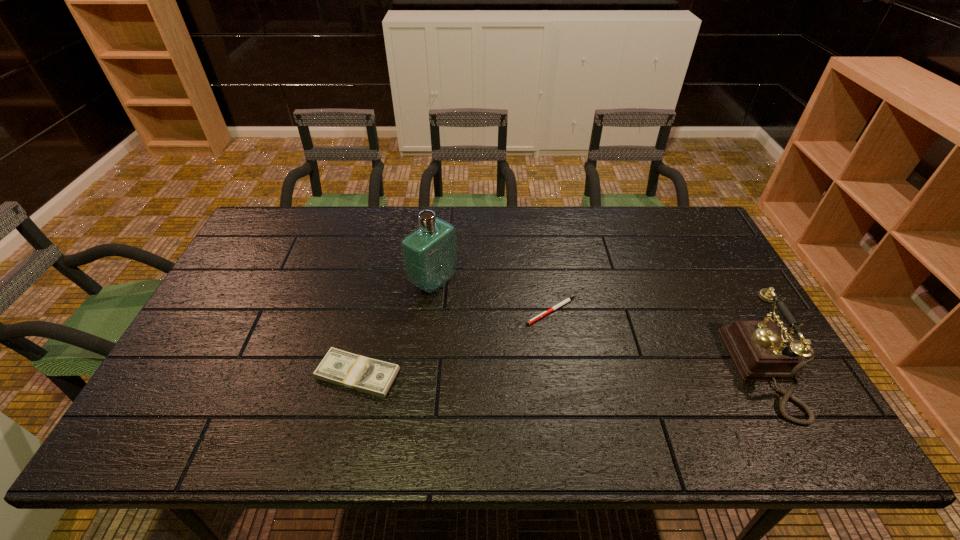
Find the location of a particular element. Image resolution: width=960 pixels, height=540 pixels. vacant space located 0.240m on the clicker of the pen is located at coordinates (513, 396).

Where is `free point located on the clicker of the pen`? free point located on the clicker of the pen is located at coordinates (518, 383).

Locate an element on the screen. vacant space located on the clicker of the pen is located at coordinates (529, 358).

The width and height of the screenshot is (960, 540). I want to click on dollar present at the near edge, so point(356,372).

Locate an element on the screen. telephone that is at the near edge is located at coordinates click(x=761, y=352).

Locate an element on the screen. object positioned at the right edge is located at coordinates (761, 352).

Identify the location of object located at the near right corner. This screenshot has height=540, width=960. pos(761,352).

I want to click on vacant space at the far edge of the desktop, so click(x=392, y=227).

Identify the location of blank area at the near edge. This screenshot has width=960, height=540. (280, 399).

Where is `vacant space at the left edge of the desktop`? The height and width of the screenshot is (540, 960). vacant space at the left edge of the desktop is located at coordinates (265, 255).